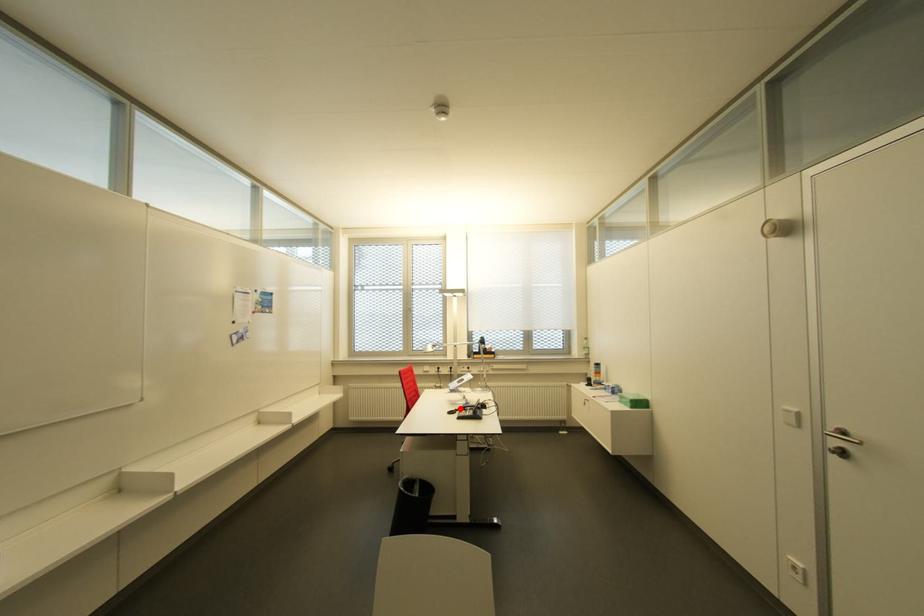
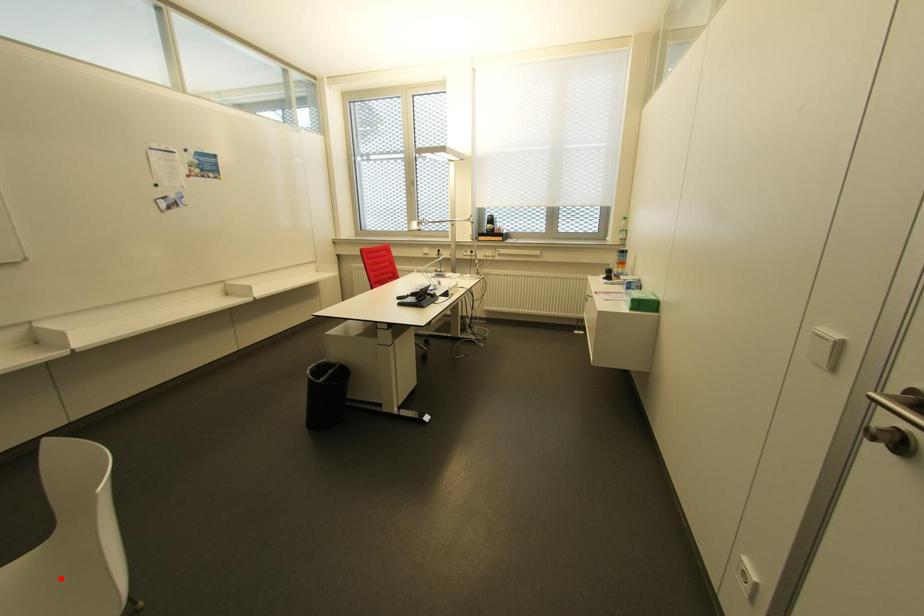
I am providing you with two images of the same scene from different viewpoints. A red point is marked on the first image and another point is marked on the second image. Does the point marked in image1 correspond to the same location as the one in image2?

No